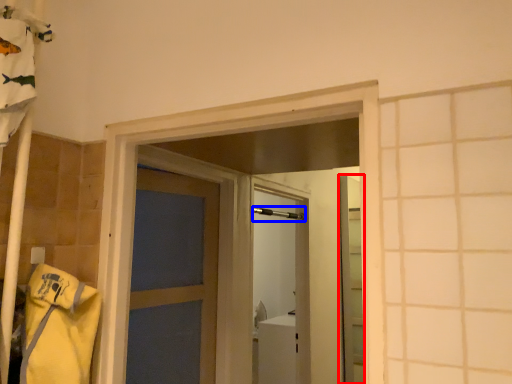
Question: Which point is closer to the camera, elevator (highlighted by a red box) or shower (highlighted by a blue box)?

Choices:
 (A) elevator
 (B) shower

Answer: (B)